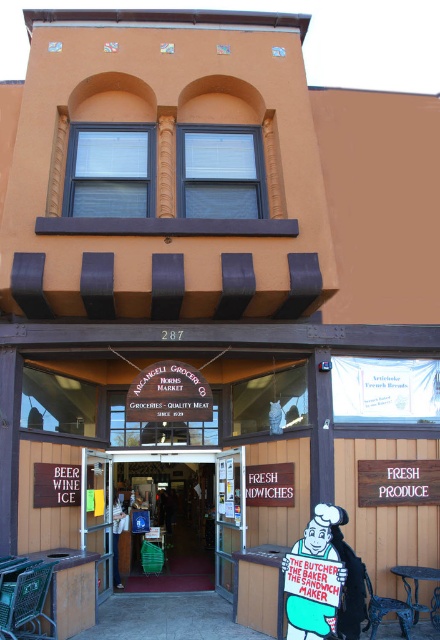
Does green plastic basket at center appear under white cotton shirt at center?

Yes, green plastic basket at center is below white cotton shirt at center.

Can you confirm if green plastic basket at center is wider than white cotton shirt at center?

Correct, the width of green plastic basket at center exceeds that of white cotton shirt at center.

Is point (134, 580) closer to camera compared to point (113, 516)?

That is False.

Identify the location of green plastic basket at center. (168, 525).

How much distance is there between wooden signboard at center and cartoonish painted figure at center?

A distance of 4.65 meters exists between wooden signboard at center and cartoonish painted figure at center.

Image resolution: width=440 pixels, height=640 pixels. What are the coordinates of `wooden signboard at center` in the screenshot? It's located at (219, 433).

Find the location of `wooden signboard at center`. wooden signboard at center is located at coordinates (219, 433).

The height and width of the screenshot is (640, 440). I want to click on wooden signboard at center, so click(219, 433).

Consider the image. Is wooden signboard at center closer to the viewer compared to green plastic basket at center?

Yes, it is.

Where is `wooden signboard at center`? wooden signboard at center is located at coordinates (219, 433).